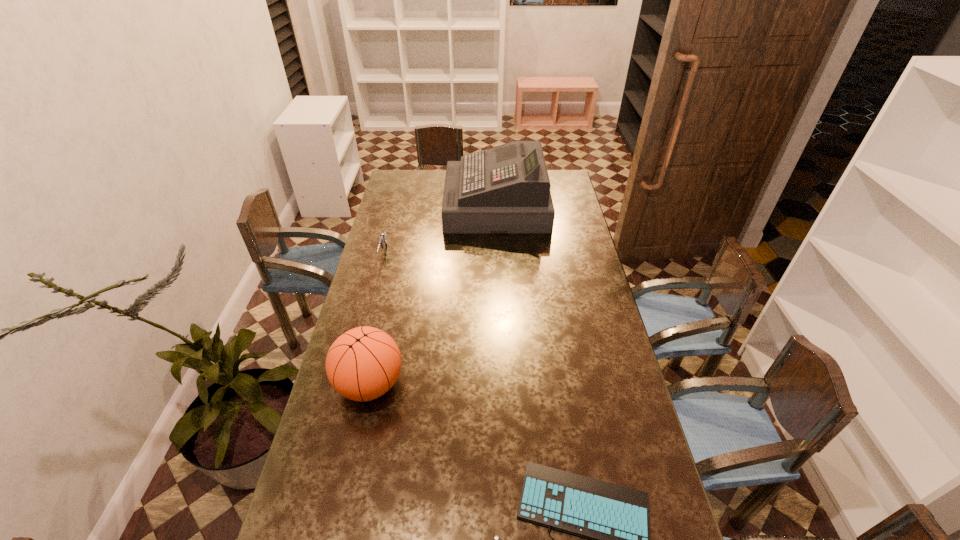
Find the location of a particular element. The height and width of the screenshot is (540, 960). free space between the gun and the basketball is located at coordinates (377, 320).

Find the location of `vacant space in between the cash register and the gun`. vacant space in between the cash register and the gun is located at coordinates (440, 230).

In order to click on free space between the tallest object and the third tallest object in this screenshot , I will do `click(440, 230)`.

Locate an element on the screen. free spot between the farthest object and the third tallest object is located at coordinates (440, 230).

Identify which object is located as the second nearest to the second tallest object. Please provide its 2D coordinates. Your answer should be formatted as a tuple, i.e. [(x, y)], where the tuple contains the x and y coordinates of a point satisfying the conditions above.

[(382, 240)]

Select which object is the second closest to the second shortest object. Please provide its 2D coordinates. Your answer should be formatted as a tuple, i.e. [(x, y)], where the tuple contains the x and y coordinates of a point satisfying the conditions above.

[(362, 364)]

You are a GUI agent. You are given a task and a screenshot of the screen. Output one action in this format:
    pyautogui.click(x=<x>, y=<y>)
    Task: Click on the vacant space that satisfies the following two spatial constraints: 1. at the barrel of the third nearest object; 2. on the right side of the second tallest object
    
    Given the screenshot: What is the action you would take?
    pyautogui.click(x=350, y=384)

You are a GUI agent. You are given a task and a screenshot of the screen. Output one action in this format:
    pyautogui.click(x=<x>, y=<y>)
    Task: Click on the free space in the image that satisfies the following two spatial constraints: 1. on the front-facing side of the farthest object; 2. at the barrel of the third tallest object
    
    Given the screenshot: What is the action you would take?
    pyautogui.click(x=498, y=255)

Find the location of a particular element. This screenshot has height=540, width=960. free space that satisfies the following two spatial constraints: 1. on the front-facing side of the farthest object; 2. at the barrel of the gun is located at coordinates [498, 255].

Where is `vacant space that satisfies the following two spatial constraints: 1. at the barrel of the third farthest object; 2. on the left side of the gun`? This screenshot has height=540, width=960. vacant space that satisfies the following two spatial constraints: 1. at the barrel of the third farthest object; 2. on the left side of the gun is located at coordinates (350, 384).